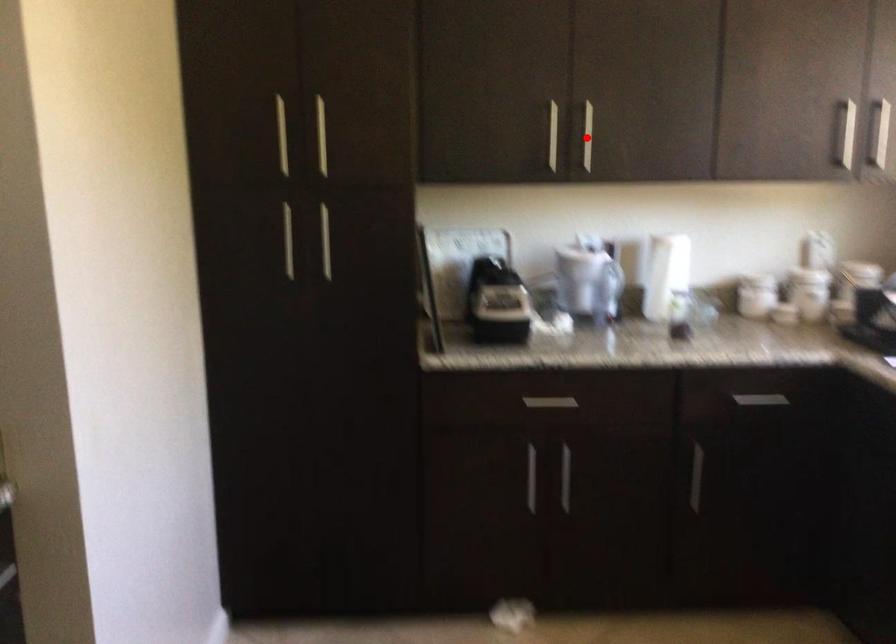
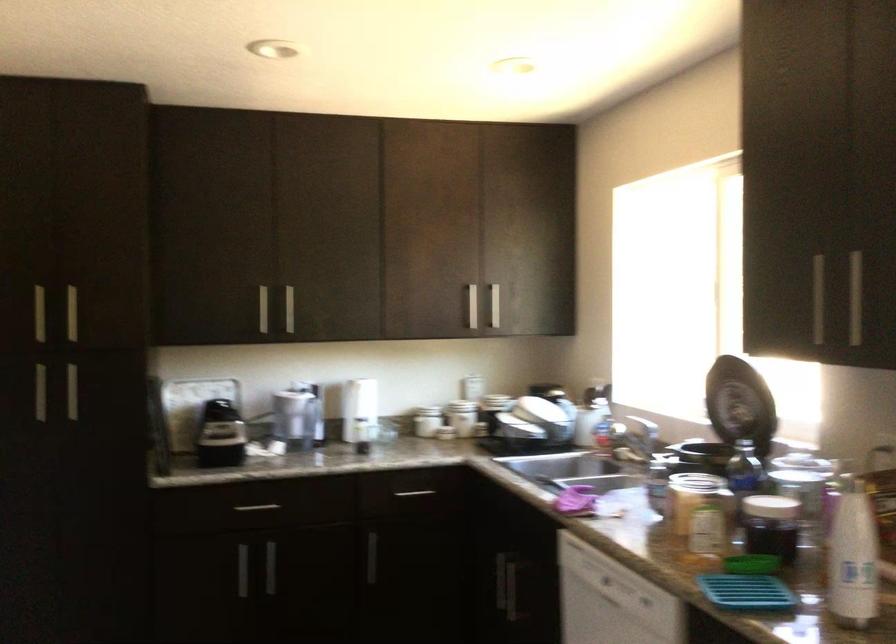
In the second image, find the point that corresponds to the highlighted location in the first image.

(289, 308)